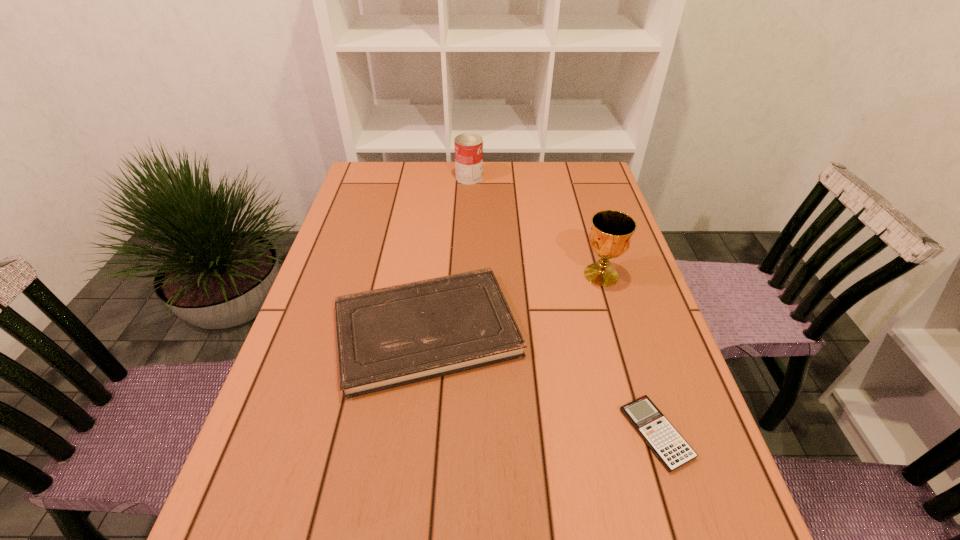
What are the coordinates of `chalice` in the screenshot? It's located at (610, 237).

This screenshot has height=540, width=960. What are the coordinates of `can` in the screenshot? It's located at (468, 146).

The height and width of the screenshot is (540, 960). Find the location of `the farthest object`. the farthest object is located at coordinates point(468,146).

Locate an element on the screen. paperback book is located at coordinates (389, 337).

Locate an element on the screen. the shortest object is located at coordinates (667, 444).

The width and height of the screenshot is (960, 540). Identify the location of vacant space located 0.090m on the left of the tallest object. (546, 275).

Identify the location of free location located on the front label of the farthest object. pos(544,178).

This screenshot has width=960, height=540. I want to click on free space located on the right of the paperback book, so click(x=632, y=330).

Where is `blank area located on the front of the shortest object`? The height and width of the screenshot is (540, 960). blank area located on the front of the shortest object is located at coordinates (682, 517).

The image size is (960, 540). What are the coordinates of `object that is at the far edge` in the screenshot? It's located at (468, 146).